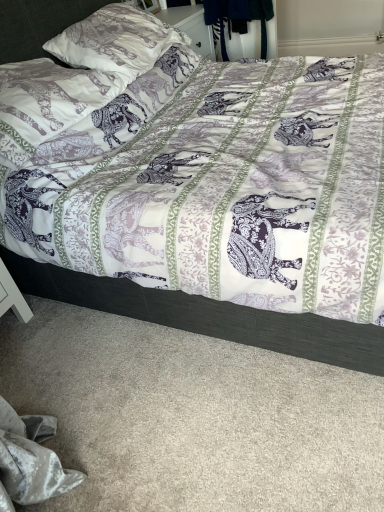
Question: Is matte white pillow at upper left, placed as the 1th pillow when sorted from top to bottom, smaller than purple printed fabric bed at center?

Choices:
 (A) yes
 (B) no

Answer: (A)

Question: Is matte white pillow at upper left, which is counted as the 2th pillow, starting from the bottom, positioned with its back to purple printed fabric bed at center?

Choices:
 (A) yes
 (B) no

Answer: (A)

Question: From the image's perspective, is matte white pillow at upper left, which is counted as the 2th pillow, starting from the bottom, below purple printed fabric bed at center?

Choices:
 (A) yes
 (B) no

Answer: (B)

Question: From a real-world perspective, is matte white pillow at upper left, placed as the 1th pillow when sorted from top to bottom, beneath purple printed fabric bed at center?

Choices:
 (A) no
 (B) yes

Answer: (A)

Question: Is matte white pillow at upper left, placed as the 1th pillow when sorted from top to bottom, placed right next to purple printed fabric bed at center?

Choices:
 (A) no
 (B) yes

Answer: (A)

Question: Considering the relative sizes of matte white pillow at upper left, placed as the 1th pillow when sorted from top to bottom, and purple printed fabric bed at center in the image provided, is matte white pillow at upper left, placed as the 1th pillow when sorted from top to bottom, thinner than purple printed fabric bed at center?

Choices:
 (A) no
 (B) yes

Answer: (B)

Question: Can you confirm if printed fabric pillow at upper left, which is the 2th pillow in top-to-bottom order, is positioned to the right of purple printed fabric bed at center?

Choices:
 (A) yes
 (B) no

Answer: (B)

Question: Does printed fabric pillow at upper left, which is the 2th pillow in top-to-bottom order, have a larger size compared to purple printed fabric bed at center?

Choices:
 (A) yes
 (B) no

Answer: (B)

Question: From the image's perspective, is printed fabric pillow at upper left, placed as the first pillow when sorted from bottom to top, beneath purple printed fabric bed at center?

Choices:
 (A) yes
 (B) no

Answer: (A)

Question: Is printed fabric pillow at upper left, which is the 2th pillow in top-to-bottom order, looking in the opposite direction of purple printed fabric bed at center?

Choices:
 (A) no
 (B) yes

Answer: (B)

Question: Can you confirm if printed fabric pillow at upper left, which is the 2th pillow in top-to-bottom order, is wider than purple printed fabric bed at center?

Choices:
 (A) yes
 (B) no

Answer: (B)

Question: Can we say printed fabric pillow at upper left, placed as the first pillow when sorted from bottom to top, lies outside purple printed fabric bed at center?

Choices:
 (A) yes
 (B) no

Answer: (B)

Question: Is matte white pillow at upper left, which is counted as the 2th pillow, starting from the bottom, at the right side of printed fabric pillow at upper left, placed as the first pillow when sorted from bottom to top?

Choices:
 (A) no
 (B) yes

Answer: (B)